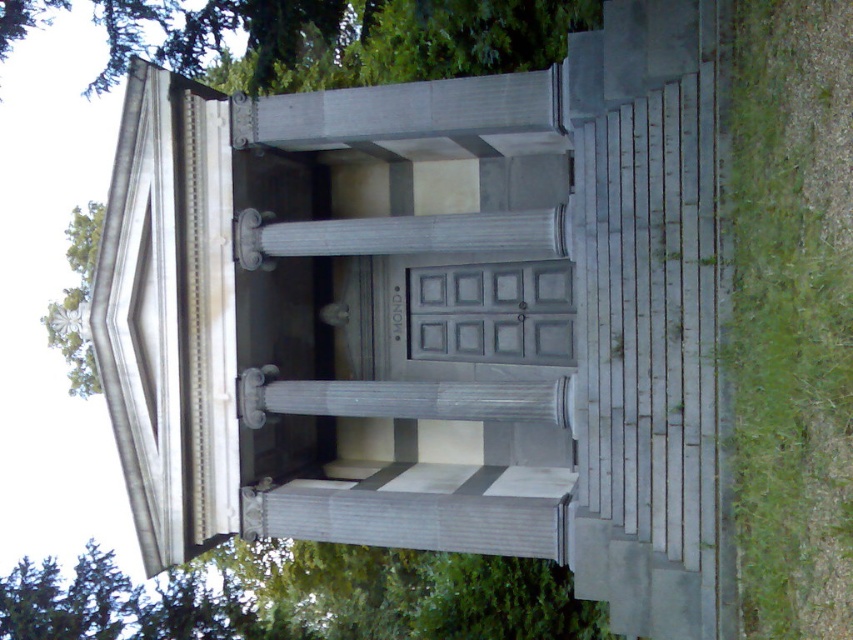
You are standing at the entrance of the classical mausoleum and want to take a photo of the green leafy tree at lower left. Which direction should you face to capture it in your shot?

The green leafy tree at lower left is located at point (x=300, y=600) in 2D coordinates, so you should face towards the lower left direction to capture it in your shot.